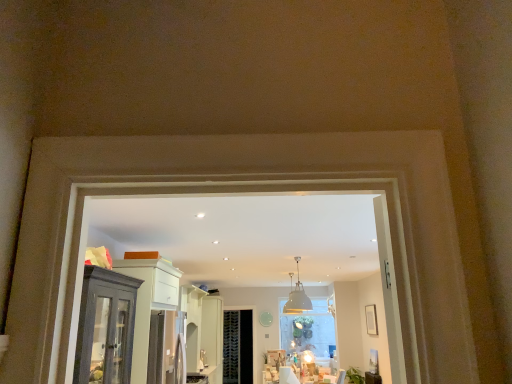
Question: Is white glossy door at center not near satin silver fridge at center?

Choices:
 (A) no
 (B) yes

Answer: (A)

Question: Does white glossy door at center have a lesser width compared to satin silver fridge at center?

Choices:
 (A) yes
 (B) no

Answer: (B)

Question: From the image's perspective, does white glossy door at center appear higher than satin silver fridge at center?

Choices:
 (A) no
 (B) yes

Answer: (A)

Question: Is satin silver fridge at center surrounded by white glossy door at center?

Choices:
 (A) yes
 (B) no

Answer: (B)

Question: From a real-world perspective, is white glossy door at center on satin silver fridge at center?

Choices:
 (A) yes
 (B) no

Answer: (A)

Question: Visually, is satin silver fridge at center positioned to the left or to the right of matte white picture frame at right?

Choices:
 (A) left
 (B) right

Answer: (A)

Question: Based on their sizes in the image, would you say satin silver fridge at center is bigger or smaller than matte white picture frame at right?

Choices:
 (A) small
 (B) big

Answer: (B)

Question: From a real-world perspective, is satin silver fridge at center above or below matte white picture frame at right?

Choices:
 (A) above
 (B) below

Answer: (B)

Question: Relative to matte white picture frame at right, is satin silver fridge at center in front or behind?

Choices:
 (A) behind
 (B) front

Answer: (B)

Question: Based on their sizes in the image, would you say white matte light fixture at upper center is bigger or smaller than matte white picture frame at right?

Choices:
 (A) big
 (B) small

Answer: (A)

Question: From a real-world perspective, is white matte light fixture at upper center above or below matte white picture frame at right?

Choices:
 (A) above
 (B) below

Answer: (A)

Question: Considering their positions, is white matte light fixture at upper center located in front of or behind matte white picture frame at right?

Choices:
 (A) behind
 (B) front

Answer: (B)

Question: From their relative heights in the image, would you say white matte light fixture at upper center is taller or shorter than matte white picture frame at right?

Choices:
 (A) tall
 (B) short

Answer: (A)

Question: Is point (221, 311) closer or farther from the camera than point (202, 379)?

Choices:
 (A) farther
 (B) closer

Answer: (A)

Question: From the image's perspective, relative to satin silver fridge at center, is white glossy door at center above or below?

Choices:
 (A) above
 (B) below

Answer: (B)